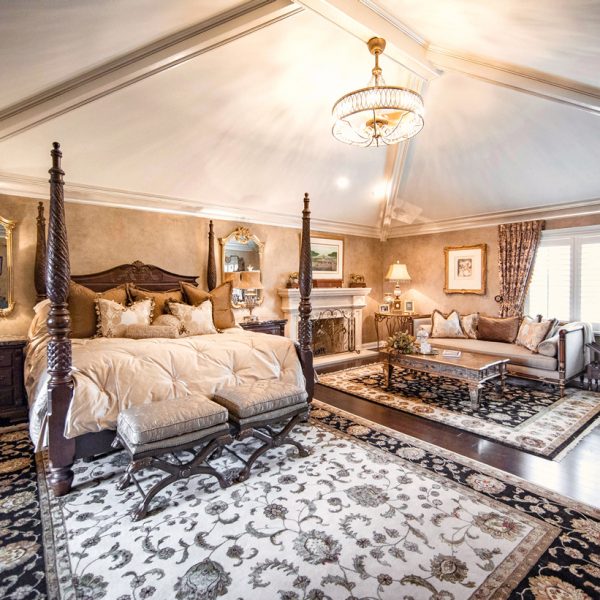
Find the location of a particular element. The height and width of the screenshot is (600, 600). fireplace is located at coordinates (329, 328).